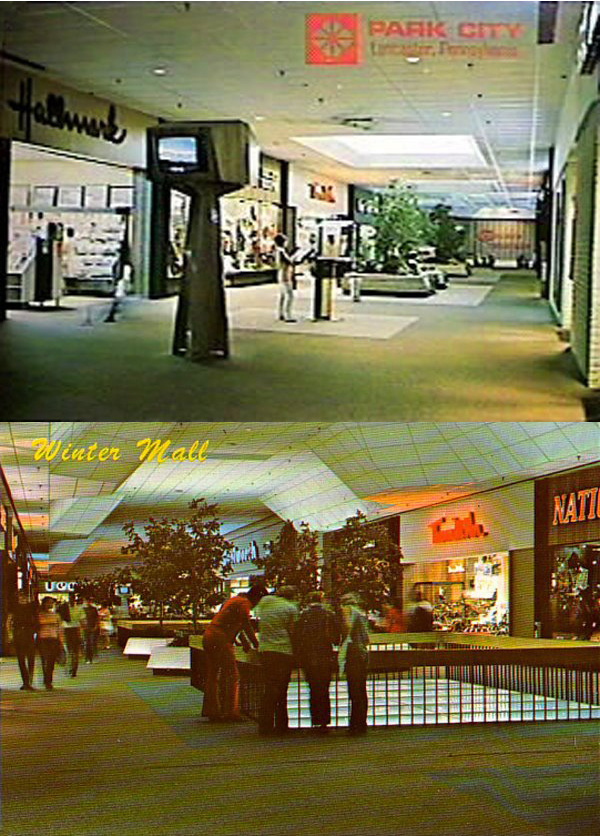
Identify the location of floor. Image resolution: width=600 pixels, height=836 pixels. (114, 742), (433, 334).